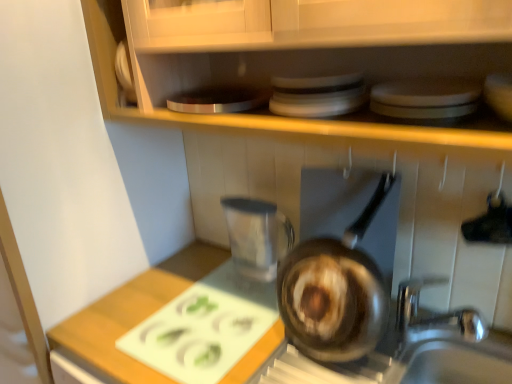
Question: From a real-world perspective, is shiny brown frying pan at center positioned under white cutting board at center based on gravity?

Choices:
 (A) yes
 (B) no

Answer: (B)

Question: Can you confirm if shiny brown frying pan at center is wider than white cutting board at center?

Choices:
 (A) no
 (B) yes

Answer: (A)

Question: From the image's perspective, does shiny brown frying pan at center appear lower than white cutting board at center?

Choices:
 (A) yes
 (B) no

Answer: (B)

Question: Would you say white cutting board at center is part of shiny brown frying pan at center's contents?

Choices:
 (A) yes
 (B) no

Answer: (B)

Question: Are shiny brown frying pan at center and white cutting board at center far apart?

Choices:
 (A) no
 (B) yes

Answer: (A)

Question: From their relative heights in the image, would you say shiny brown frying pan at center is taller or shorter than white cutting board at center?

Choices:
 (A) tall
 (B) short

Answer: (A)

Question: Is shiny brown frying pan at center inside or outside of white cutting board at center?

Choices:
 (A) inside
 (B) outside

Answer: (B)

Question: From the image's perspective, is shiny brown frying pan at center located above or below white cutting board at center?

Choices:
 (A) above
 (B) below

Answer: (A)

Question: Based on their sizes in the image, would you say shiny brown frying pan at center is bigger or smaller than white cutting board at center?

Choices:
 (A) big
 (B) small

Answer: (A)

Question: Which is correct: shiny brown frying pan at center is inside white glossy plates at upper center, or outside of it?

Choices:
 (A) inside
 (B) outside

Answer: (B)

Question: From the image's perspective, relative to white glossy plates at upper center, is shiny brown frying pan at center above or below?

Choices:
 (A) above
 (B) below

Answer: (B)

Question: Is shiny brown frying pan at center in front of or behind white glossy plates at upper center in the image?

Choices:
 (A) behind
 (B) front

Answer: (A)

Question: From a real-world perspective, is shiny brown frying pan at center physically located above or below white glossy plates at upper center?

Choices:
 (A) below
 (B) above

Answer: (A)

Question: In terms of height, does white glossy plates at upper center look taller or shorter compared to shiny brown frying pan at center?

Choices:
 (A) short
 (B) tall

Answer: (A)

Question: Is white glossy plates at upper center wider or thinner than shiny brown frying pan at center?

Choices:
 (A) thin
 (B) wide

Answer: (B)